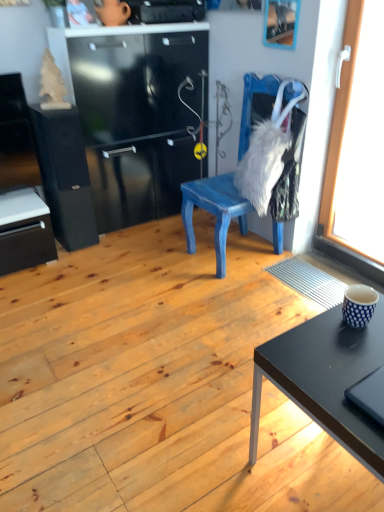
Where is `free space to the left of black matte laptop at lower right`? The width and height of the screenshot is (384, 512). free space to the left of black matte laptop at lower right is located at coordinates (326, 376).